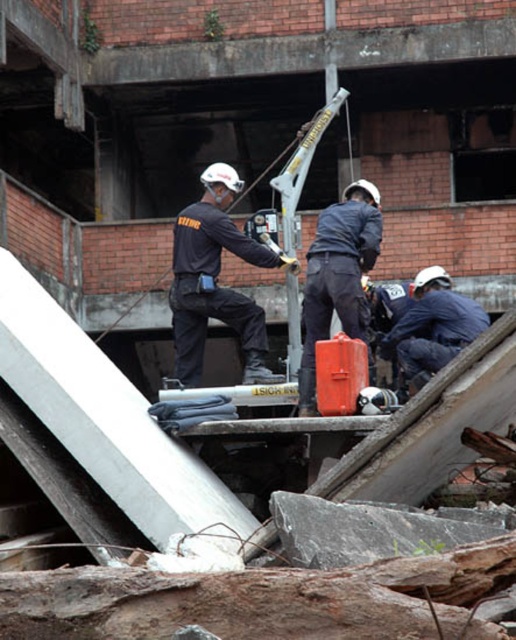
Question: Among these objects, which one is farthest from the camera?

Choices:
 (A) metallic silver crane at center
 (B) blue fabric at lower right
 (C) matte orange tool box at center
 (D) black matte uniform at center

Answer: (D)

Question: Does black matte uniform at center lie behind matte orange tool box at center?

Choices:
 (A) yes
 (B) no

Answer: (A)

Question: Considering the real-world distances, which object is farthest from the black matte uniform at center?

Choices:
 (A) matte orange tool box at center
 (B) metallic silver crane at center

Answer: (B)

Question: From the image, what is the correct spatial relationship of black matte uniform at center in relation to blue fabric at lower right?

Choices:
 (A) left
 (B) right

Answer: (A)

Question: Is the position of black matte uniform at center less distant than that of matte orange tool box at center?

Choices:
 (A) yes
 (B) no

Answer: (B)

Question: Estimate the real-world distances between objects in this image. Which object is closer to the black matte uniform at center?

Choices:
 (A) matte orange tool box at center
 (B) blue fabric at lower right

Answer: (A)